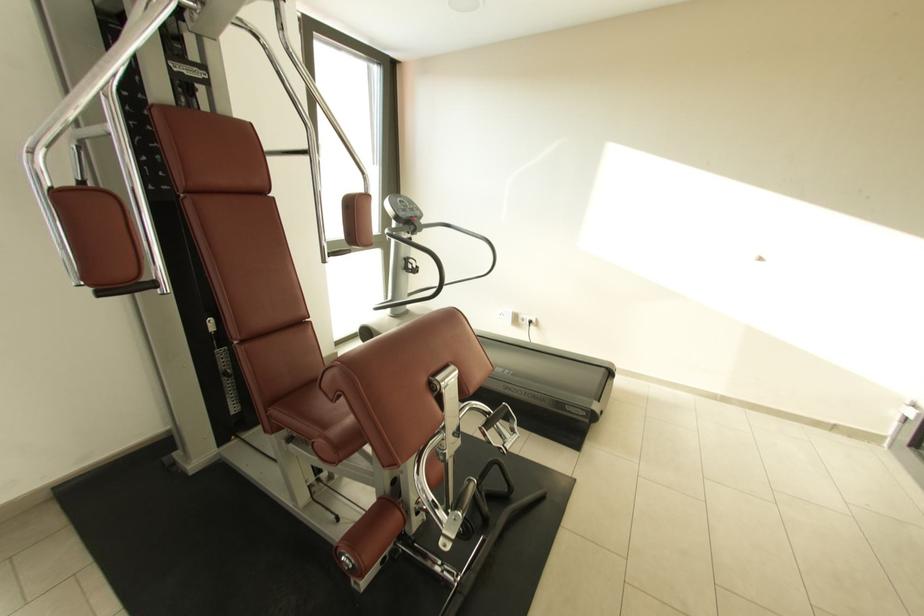
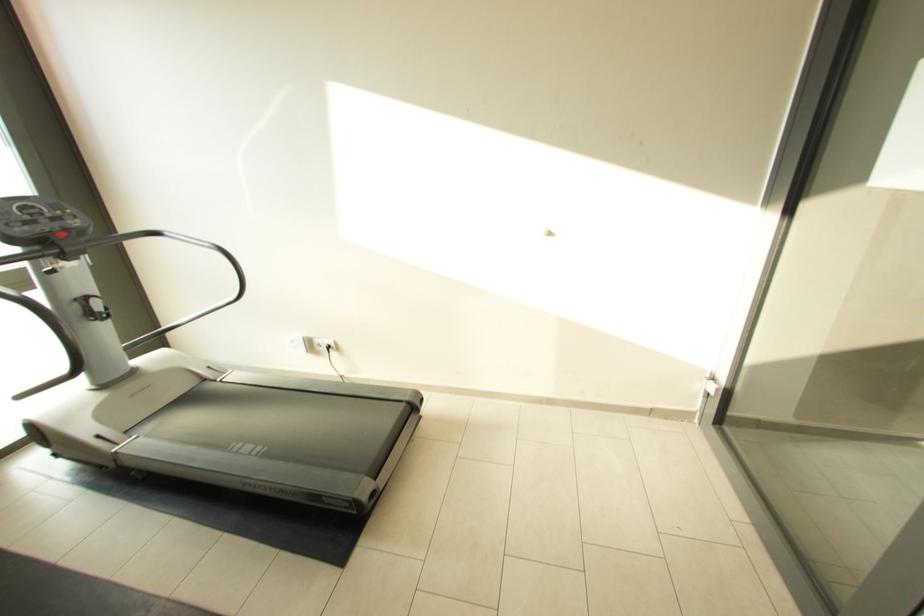
The point at [526,317] is marked in the first image. Where is the corresponding point in the second image?

(322, 342)